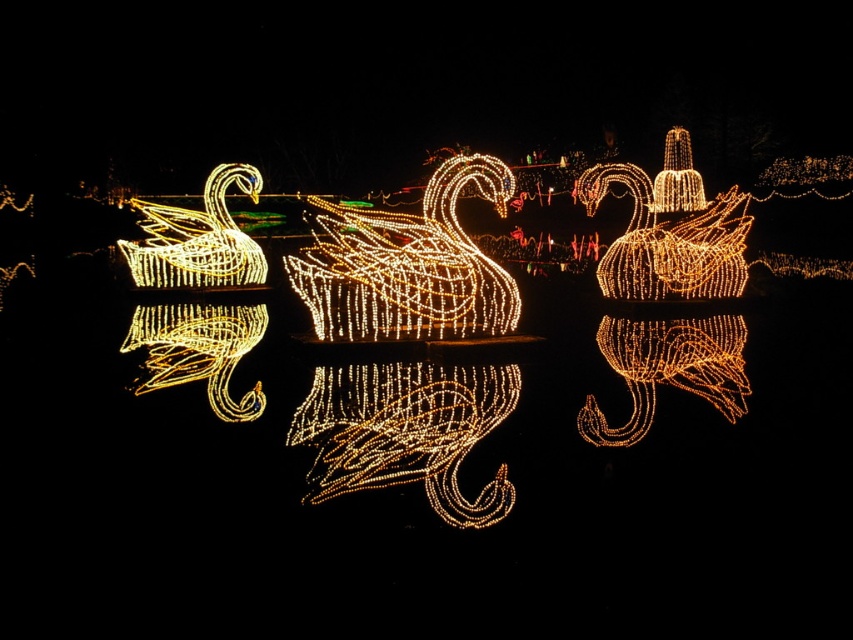
Does illuminated wireframe swan at center have a larger size compared to illuminated wireframe swan at left?

No.

Who is higher up, illuminated wireframe swan at center or illuminated wireframe swan at left?

Positioned higher is illuminated wireframe swan at left.

Between point (354, 230) and point (238, 240), which one is positioned in front?

Point (354, 230)

Locate an element on the screen. illuminated wireframe swan at center is located at coordinates (408, 266).